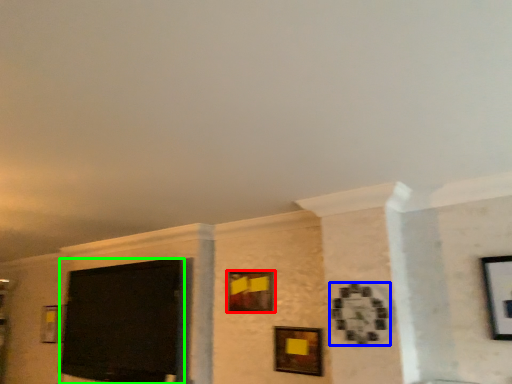
Question: Which object is the farthest from picture frame (highlighted by a red box)? Choose among these: picture frame (highlighted by a blue box) or projection screen (highlighted by a green box).

Choices:
 (A) picture frame
 (B) projection screen

Answer: (B)